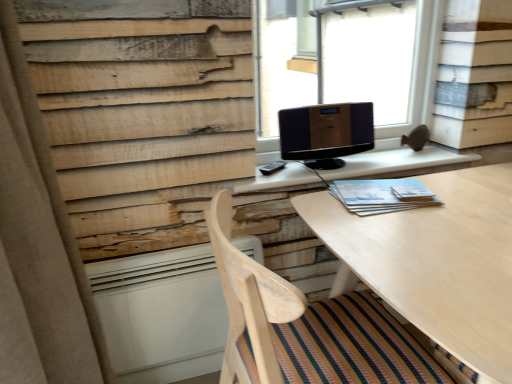
Where is `vacant area located to the right-hand side of light blue paper at right`? The height and width of the screenshot is (384, 512). vacant area located to the right-hand side of light blue paper at right is located at coordinates (461, 193).